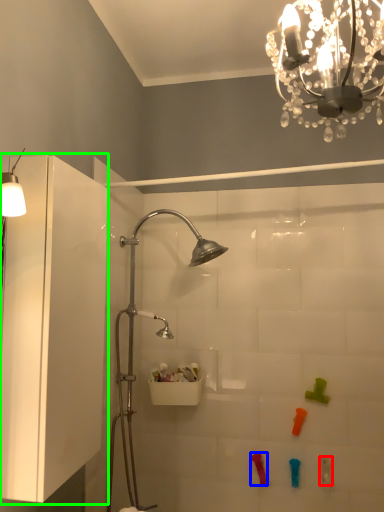
Question: Which object is the farthest from toy (highlighted by a red box)? Choose among these: toy (highlighted by a blue box) or glass door (highlighted by a green box).

Choices:
 (A) toy
 (B) glass door

Answer: (B)